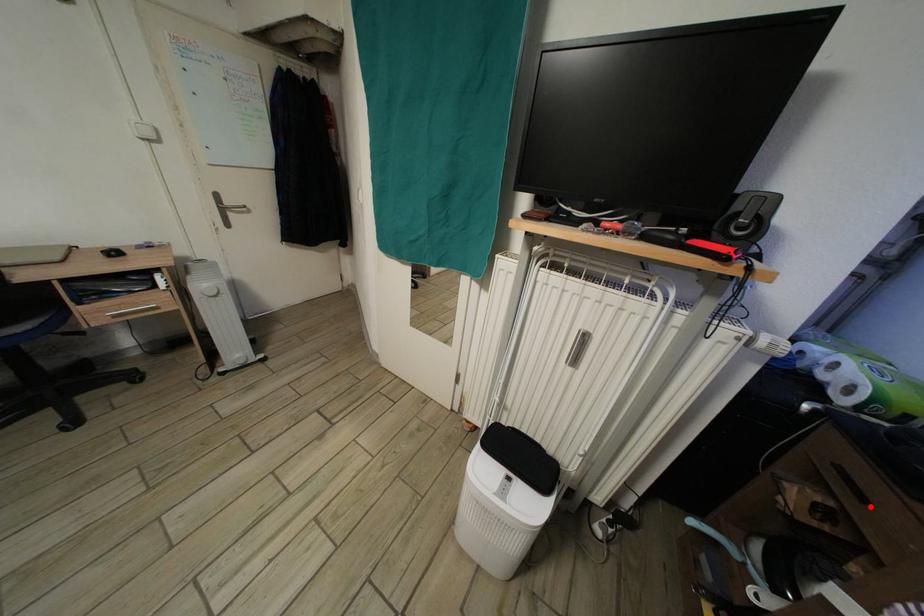
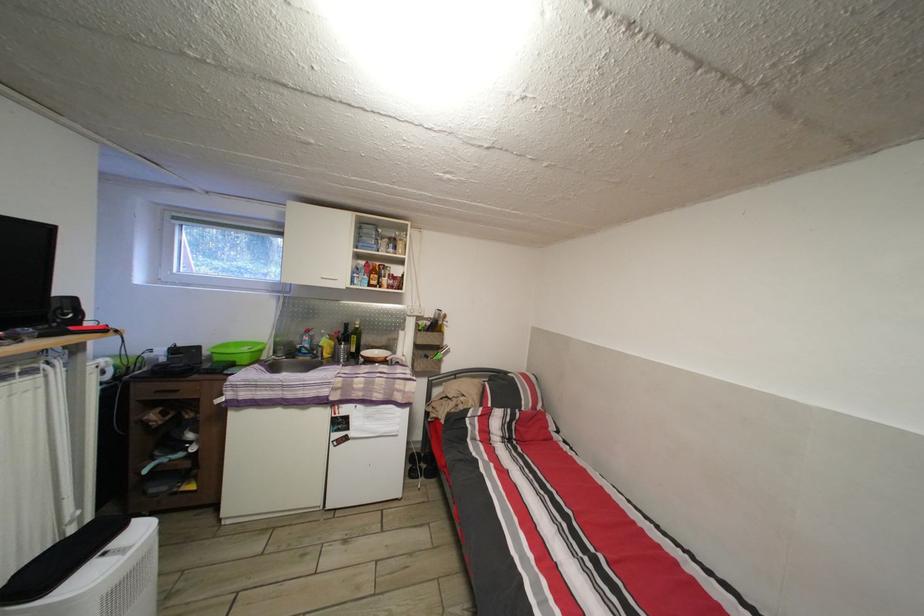
Locate, in the second image, the point that corresponds to the highlighted location in the first image.

(184, 398)